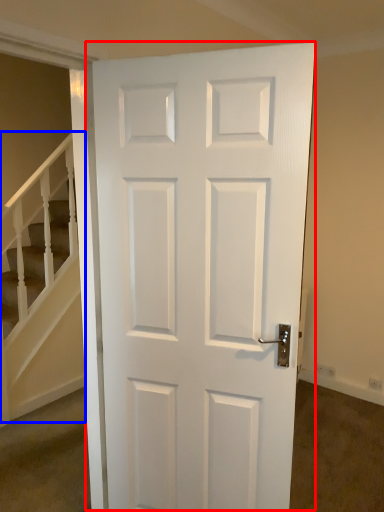
Question: Which of the following is the closest to the observer, door (highlighted by a red box) or stairwell (highlighted by a blue box)?

Choices:
 (A) door
 (B) stairwell

Answer: (A)